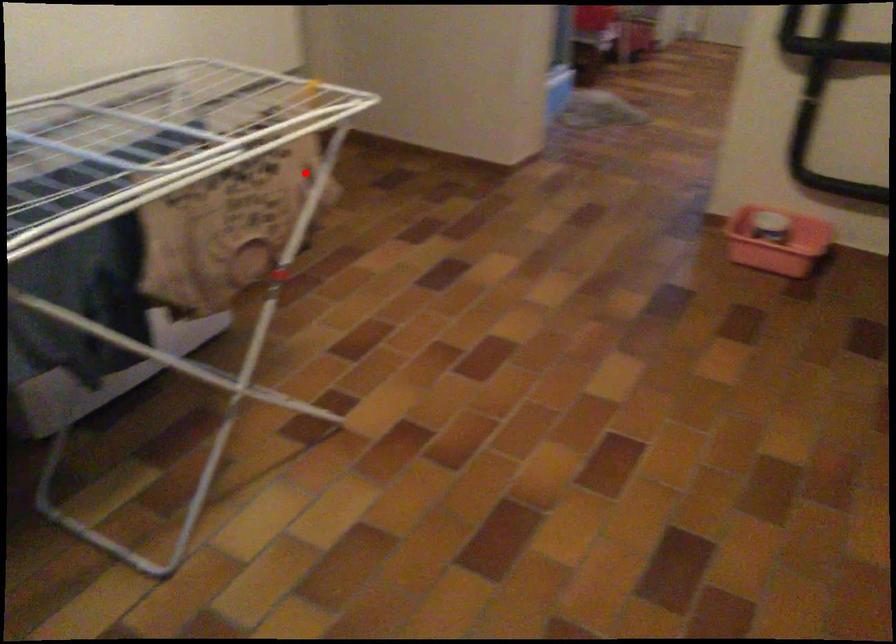
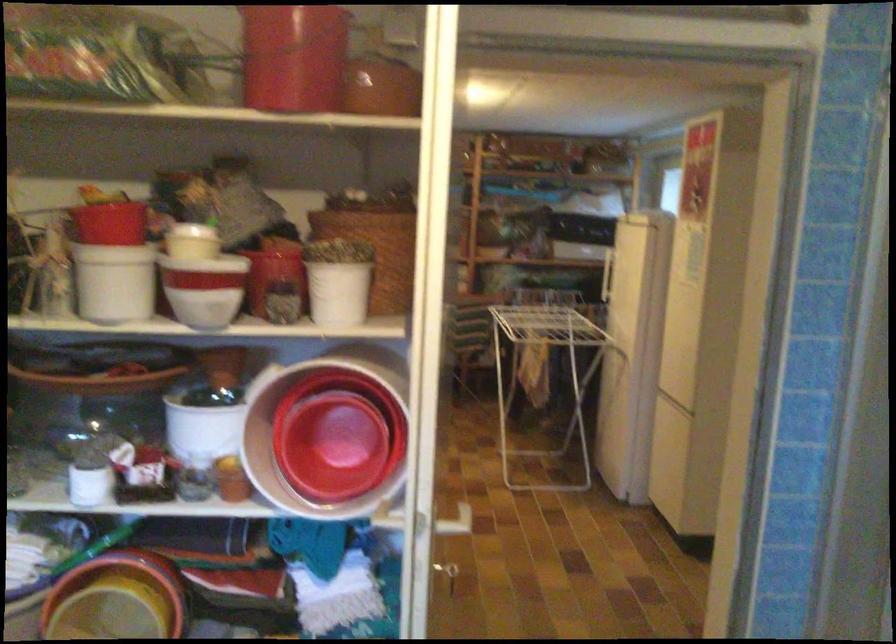
Where in the second image is the point corresponding to the highlighted location from the first image?

(545, 375)